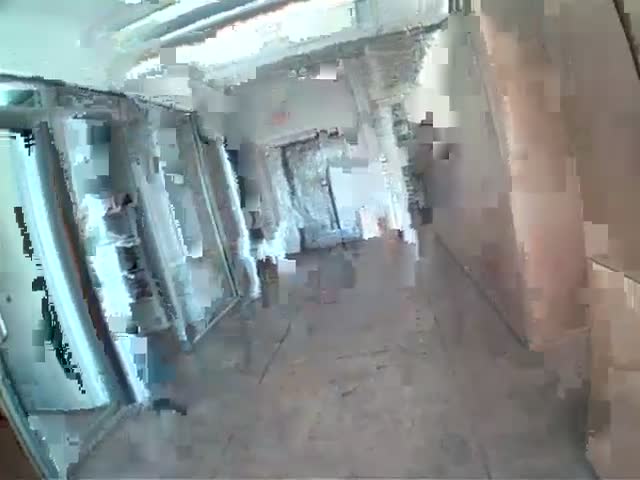
Where is `exit sign with red lettering`? The image size is (640, 480). exit sign with red lettering is located at coordinates pos(290,112).